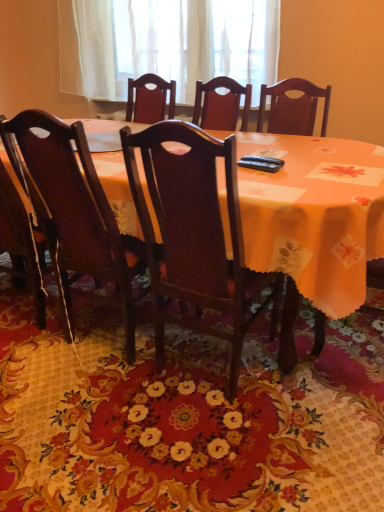
Where is `vacant area in front of wooden chair at center, the second chair in the right-to-left sequence`? The width and height of the screenshot is (384, 512). vacant area in front of wooden chair at center, the second chair in the right-to-left sequence is located at coordinates (94, 412).